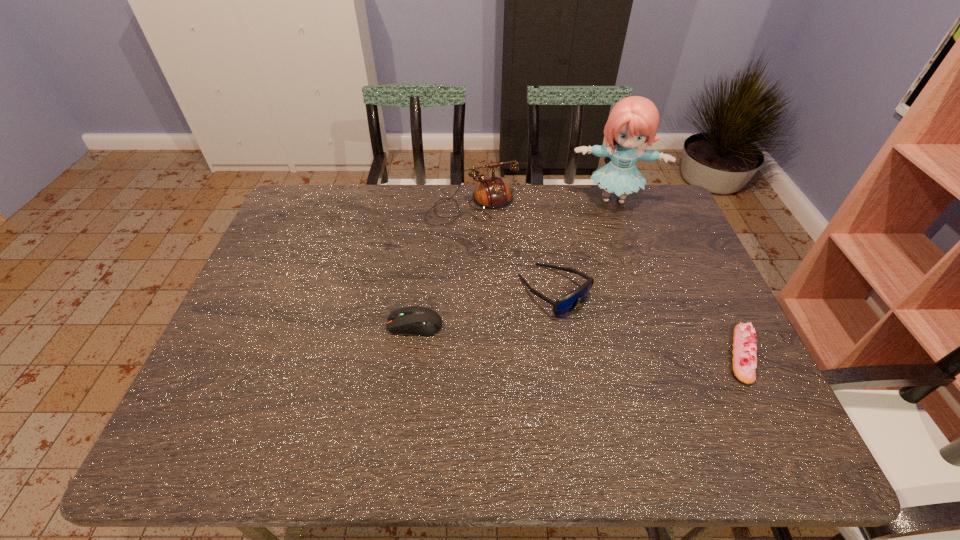
Locate an element on the screen. This screenshot has height=540, width=960. vacant space on the desktop that is between the computer equipment and the eclair and is positioned on the front-facing side of the sunglasses is located at coordinates (622, 343).

This screenshot has width=960, height=540. Identify the location of free space on the desktop that is between the computer equipment and the eclair and is positioned on the front-facing side of the doll. (618, 343).

At what (x,y) coordinates should I click in order to perform the action: click on free space on the desktop that is between the computer equipment and the eclair and is positioned on the rotary dial of the fourth shortest object. Please return your answer as a coordinate pair (x, y). Looking at the image, I should click on (542, 336).